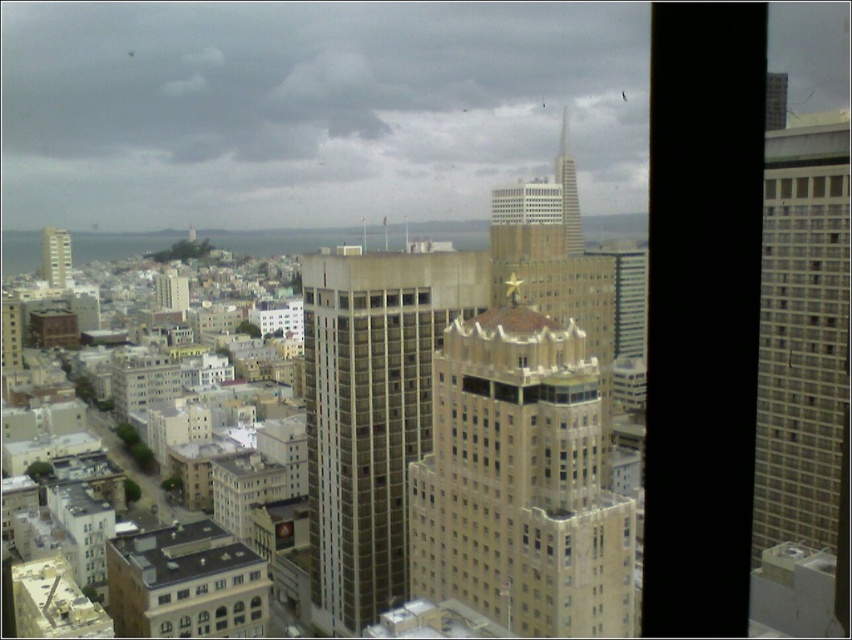
Consider the image. You are a city planner reviewing the city layout. You need to determine if the beige stone tower at center can be seen from the observation deck of the beige stone skyscraper at upper center. Based on their positions and sizes, what do you conclude?

The beige stone tower at center might be wider than beige stone skyscraper at upper center, so it could potentially block the view from the observation deck of the beige stone skyscraper at upper center depending on their exact positions and the angle of observation.

You are an urban planner analyzing the city layout. You notice the beige concrete building at center and the light beige concrete building at left. Which one has a larger footprint in the city plan?

The beige concrete building at center has a larger footprint than the light beige concrete building at left because it is bigger in size according to the description.

You are an urban planner analyzing the city layout. You need to determine which of the two buildings, the beige concrete building at center or the light beige concrete building at left, has a larger footprint in terms of width. Based on the scene, which one is wider?

The beige concrete building at center has a larger width than the light beige concrete building at left, so it has a wider footprint.